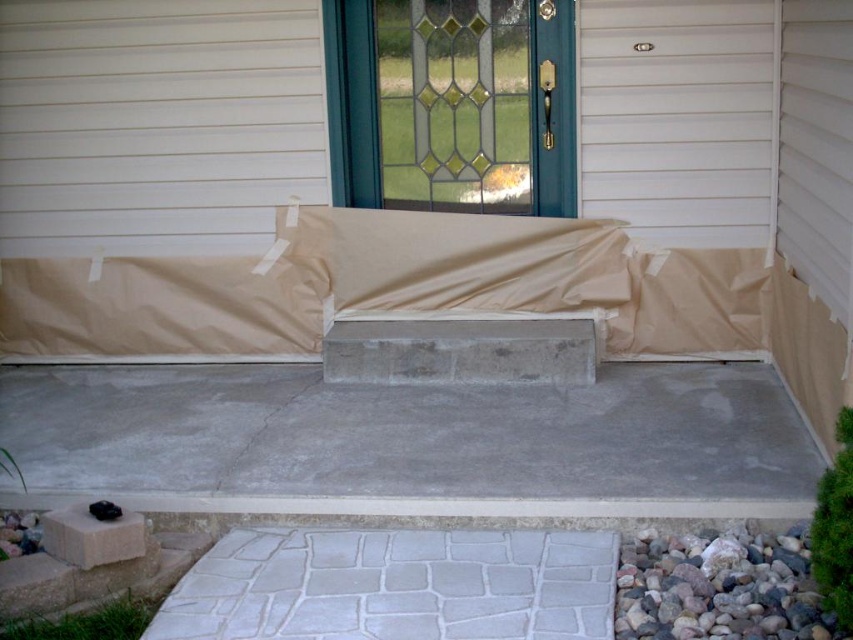
Question: Which of the following is the closest to the observer?

Choices:
 (A) (804, 557)
 (B) (339, 566)

Answer: (A)

Question: Which point is closer to the camera?

Choices:
 (A) (711, 17)
 (B) (560, 52)
 (C) (808, 612)
 (D) (242, 544)

Answer: (C)

Question: Is white painted wood door at upper center bigger than gold polished brass door handle at center?

Choices:
 (A) no
 (B) yes

Answer: (B)

Question: Is white painted wood door at upper center wider than gold polished brass door handle at center?

Choices:
 (A) no
 (B) yes

Answer: (B)

Question: Is gray rock at lower right further to camera compared to gold polished brass door handle at center?

Choices:
 (A) no
 (B) yes

Answer: (A)

Question: Which of these objects is positioned closest to the gray stone-like at lower center?

Choices:
 (A) gold polished brass door handle at center
 (B) white painted wood door at upper center

Answer: (B)